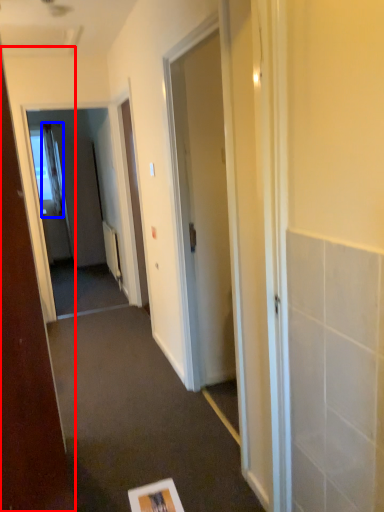
Question: Which point is closer to the camera, door (highlighted by a red box) or curtain (highlighted by a blue box)?

Choices:
 (A) door
 (B) curtain

Answer: (A)